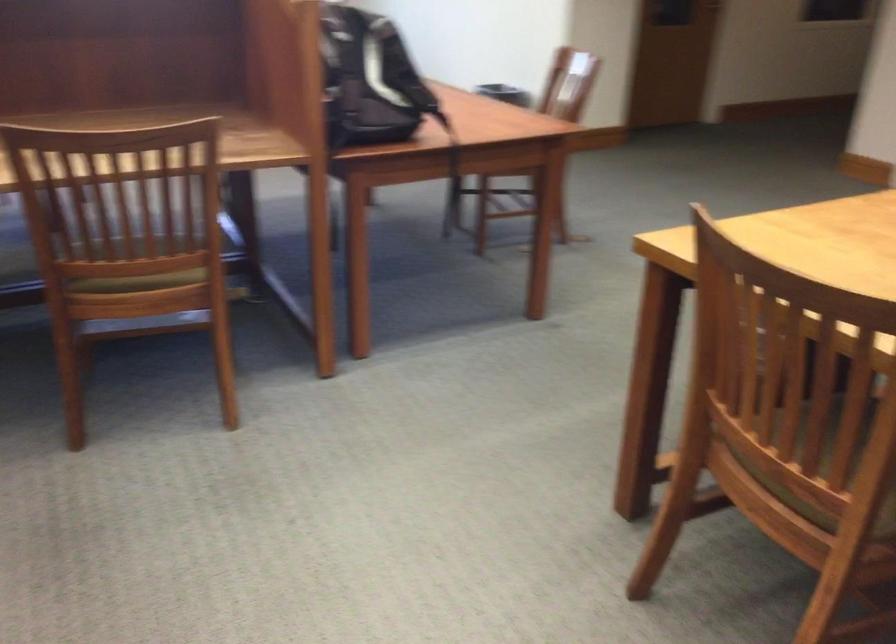
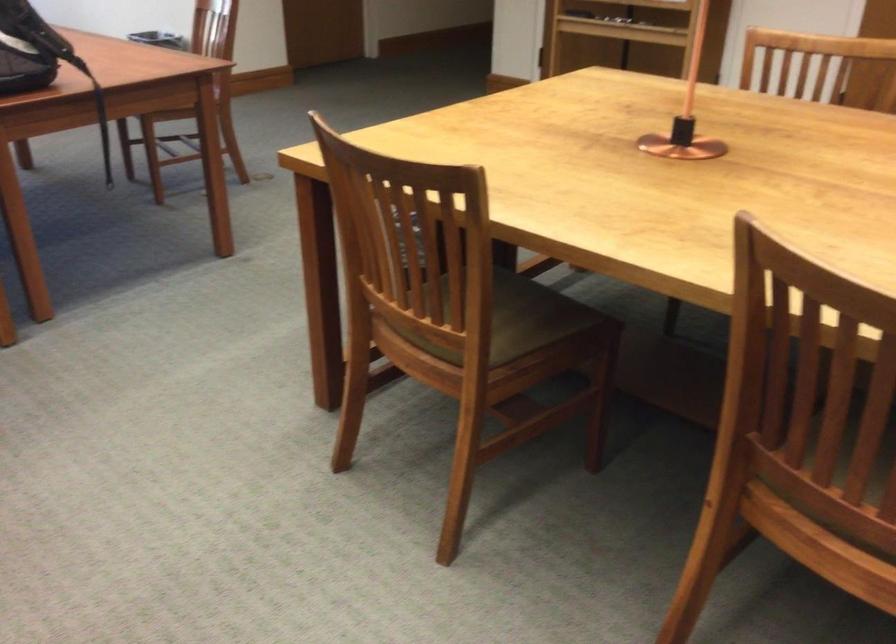
Question: The first image is from the beginning of the video and the second image is from the end. How did the camera likely rotate when shooting the video?

Choices:
 (A) Left
 (B) Right
 (C) Up
 (D) Down

Answer: (B)